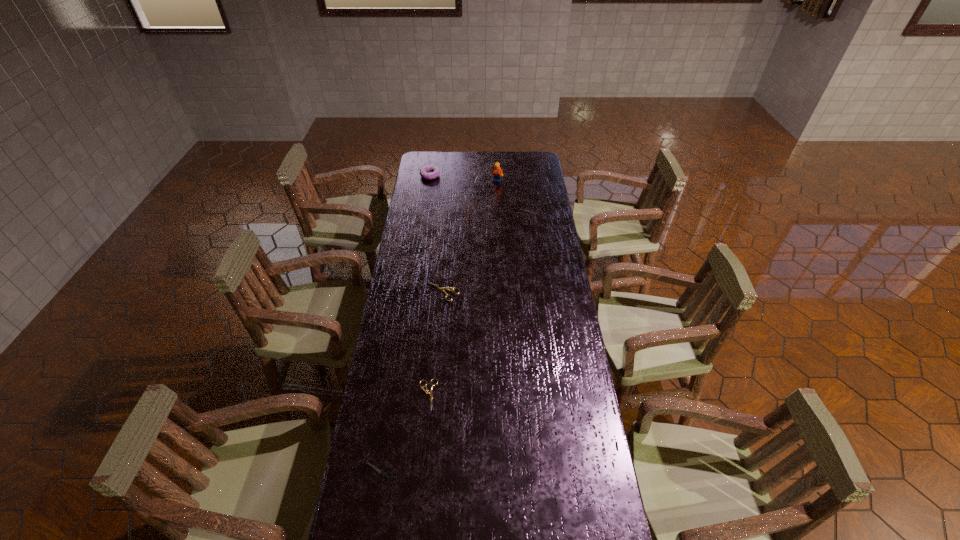
This screenshot has height=540, width=960. Identify the location of doughnut that is at the left edge. [424, 171].

At what (x,y) coordinates should I click in order to perform the action: click on object that is at the right edge. Please return your answer as a coordinate pair (x, y). This screenshot has width=960, height=540. Looking at the image, I should click on (521, 208).

Where is `object that is at the far left corner`? object that is at the far left corner is located at coordinates (424, 171).

Locate an element on the screen. vacant area at the left edge is located at coordinates (400, 449).

Where is `free space at the right edge`? The height and width of the screenshot is (540, 960). free space at the right edge is located at coordinates (559, 320).

Locate an element on the screen. This screenshot has width=960, height=540. vacant space at the far left corner of the desktop is located at coordinates (442, 163).

What are the coordinates of `vacant area between the tallest object and the smaller beige shears` in the screenshot? It's located at (462, 287).

This screenshot has height=540, width=960. I want to click on unoccupied area between the second nearest shears and the tallest object, so click(462, 287).

At what (x,y) coordinates should I click in order to perform the action: click on empty space between the sunglasses and the nearest object. Please return your answer as a coordinate pair (x, y). The image size is (960, 540). Looking at the image, I should click on pos(419,343).

Locate an element on the screen. free spot between the Lego and the purple doughnut is located at coordinates (464, 178).